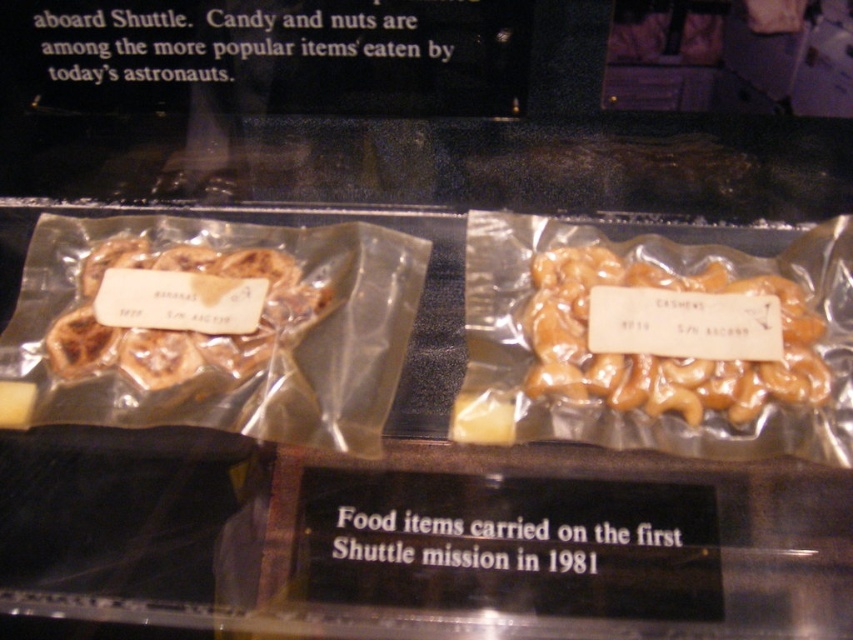
Looking at this image, which is more to the left, golden caramel cashews at center or brown matte cashews at left?

brown matte cashews at left

Can you confirm if golden caramel cashews at center is positioned above brown matte cashews at left?

No.

Which is in front, point (630, 384) or point (312, 289)?

Positioned in front is point (630, 384).

Where is `golden caramel cashews at center`? The width and height of the screenshot is (853, 640). golden caramel cashews at center is located at coordinates (663, 355).